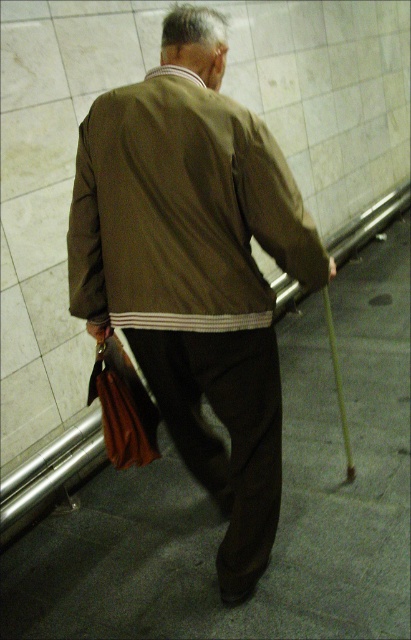
Consider the image. Between brown fabric jacket at center and brown textured jacket at center, which one appears on the left side from the viewer's perspective?

Positioned to the left is brown textured jacket at center.

Is the position of brown fabric jacket at center less distant than that of brown textured jacket at center?

No, it is not.

You are a GUI agent. You are given a task and a screenshot of the screen. Output one action in this format:
    pyautogui.click(x=<x>, y=<y>)
    Task: Click on the brown fabric jacket at center
    
    Given the screenshot: What is the action you would take?
    pyautogui.click(x=194, y=269)

This screenshot has width=411, height=640. I want to click on brown fabric jacket at center, so click(x=194, y=269).